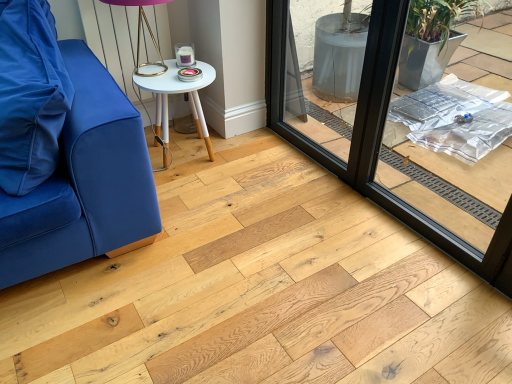
Question: Is black glass window frame at center outside matte blue cushion at left?

Choices:
 (A) yes
 (B) no

Answer: (A)

Question: Is black glass window frame at center beside matte blue cushion at left?

Choices:
 (A) yes
 (B) no

Answer: (B)

Question: Is black glass window frame at center surrounding matte blue cushion at left?

Choices:
 (A) no
 (B) yes

Answer: (A)

Question: Does black glass window frame at center have a lesser height compared to matte blue cushion at left?

Choices:
 (A) yes
 (B) no

Answer: (B)

Question: Does black glass window frame at center have a larger size compared to matte blue cushion at left?

Choices:
 (A) no
 (B) yes

Answer: (B)

Question: Can you confirm if black glass window frame at center is wider than matte blue cushion at left?

Choices:
 (A) yes
 (B) no

Answer: (B)

Question: Is black glass window frame at center looking in the opposite direction of white wood side table at center?

Choices:
 (A) yes
 (B) no

Answer: (B)

Question: Is black glass window frame at center in contact with white wood side table at center?

Choices:
 (A) no
 (B) yes

Answer: (A)

Question: Does black glass window frame at center turn towards white wood side table at center?

Choices:
 (A) no
 (B) yes

Answer: (B)

Question: Can we say black glass window frame at center lies outside white wood side table at center?

Choices:
 (A) no
 (B) yes

Answer: (B)

Question: Does black glass window frame at center lie behind white wood side table at center?

Choices:
 (A) no
 (B) yes

Answer: (A)

Question: Would you consider black glass window frame at center to be distant from white wood side table at center?

Choices:
 (A) no
 (B) yes

Answer: (A)

Question: Does white wood side table at center come in front of black glass window frame at center?

Choices:
 (A) no
 (B) yes

Answer: (A)